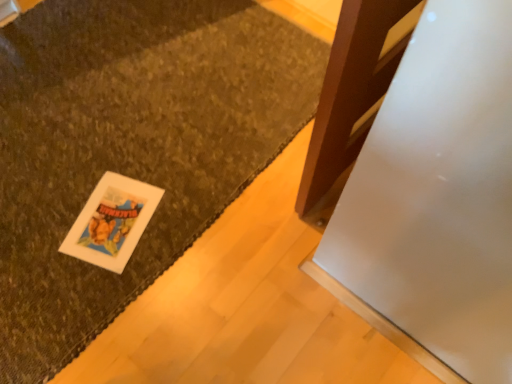
Image resolution: width=512 pixels, height=384 pixels. I want to click on free space in front of white matte card at lower left, so click(85, 297).